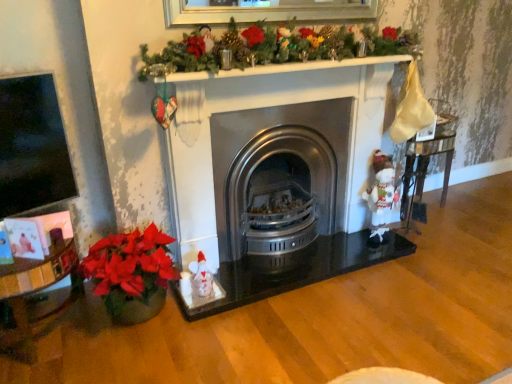
Question: Is wooden glossy table at right bigger than stainless steel wood burning stove at center?

Choices:
 (A) no
 (B) yes

Answer: (A)

Question: Does wooden glossy table at right have a greater width compared to stainless steel wood burning stove at center?

Choices:
 (A) yes
 (B) no

Answer: (B)

Question: Is wooden glossy table at right thinner than stainless steel wood burning stove at center?

Choices:
 (A) yes
 (B) no

Answer: (A)

Question: Can you confirm if wooden glossy table at right is smaller than stainless steel wood burning stove at center?

Choices:
 (A) yes
 (B) no

Answer: (A)

Question: Considering the relative sizes of wooden glossy table at right and stainless steel wood burning stove at center in the image provided, is wooden glossy table at right shorter than stainless steel wood burning stove at center?

Choices:
 (A) no
 (B) yes

Answer: (B)

Question: Would you say wooden glossy table at right is a long distance from stainless steel wood burning stove at center?

Choices:
 (A) no
 (B) yes

Answer: (A)

Question: From the image's perspective, does stainless steel wood burning stove at center appear higher than wooden glossy table at right?

Choices:
 (A) no
 (B) yes

Answer: (A)

Question: From the image's perspective, is stainless steel wood burning stove at center located beneath wooden glossy table at right?

Choices:
 (A) yes
 (B) no

Answer: (A)

Question: Considering the relative sizes of stainless steel wood burning stove at center and wooden glossy table at right in the image provided, is stainless steel wood burning stove at center thinner than wooden glossy table at right?

Choices:
 (A) no
 (B) yes

Answer: (A)

Question: Does stainless steel wood burning stove at center lie behind wooden glossy table at right?

Choices:
 (A) no
 (B) yes

Answer: (A)

Question: Does stainless steel wood burning stove at center appear on the left side of wooden glossy table at right?

Choices:
 (A) no
 (B) yes

Answer: (B)

Question: Is stainless steel wood burning stove at center oriented towards wooden glossy table at right?

Choices:
 (A) yes
 (B) no

Answer: (B)

Question: Is stainless steel wood burning stove at center outside white plush santa at right?

Choices:
 (A) yes
 (B) no

Answer: (A)